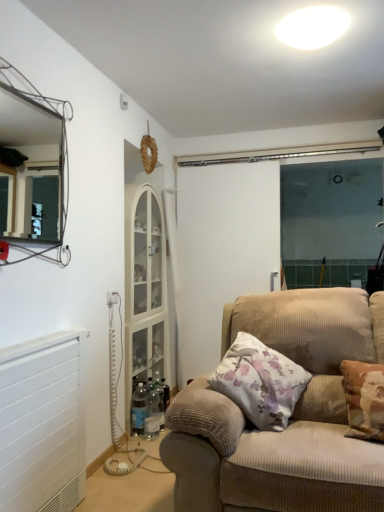
Question: Should I look upward or downward to see white floral cushion at right?

Choices:
 (A) up
 (B) down

Answer: (B)

Question: Is white plastic electric outlet at lower left further to the viewer compared to white floral cushion at right?

Choices:
 (A) yes
 (B) no

Answer: (A)

Question: Can you confirm if white plastic electric outlet at lower left is positioned to the left of white floral cushion at right?

Choices:
 (A) no
 (B) yes

Answer: (B)

Question: From the image's perspective, is white plastic electric outlet at lower left on white floral cushion at right?

Choices:
 (A) yes
 (B) no

Answer: (A)

Question: From a real-world perspective, is white plastic electric outlet at lower left on top of white floral cushion at right?

Choices:
 (A) yes
 (B) no

Answer: (A)

Question: Does white plastic electric outlet at lower left have a greater height compared to white floral cushion at right?

Choices:
 (A) yes
 (B) no

Answer: (B)

Question: Does white plastic electric outlet at lower left have a larger size compared to white floral cushion at right?

Choices:
 (A) yes
 (B) no

Answer: (B)

Question: Could you tell me if white glossy ceiling light at upper center is facing beige corduroy couch at center?

Choices:
 (A) yes
 (B) no

Answer: (B)

Question: Is white glossy ceiling light at upper center further to the viewer compared to beige corduroy couch at center?

Choices:
 (A) no
 (B) yes

Answer: (B)

Question: Is white glossy ceiling light at upper center thinner than beige corduroy couch at center?

Choices:
 (A) no
 (B) yes

Answer: (B)

Question: From a real-world perspective, is white glossy ceiling light at upper center located beneath beige corduroy couch at center?

Choices:
 (A) yes
 (B) no

Answer: (B)

Question: Does white glossy ceiling light at upper center have a larger size compared to beige corduroy couch at center?

Choices:
 (A) yes
 (B) no

Answer: (B)

Question: Are white glossy ceiling light at upper center and beige corduroy couch at center far apart?

Choices:
 (A) no
 (B) yes

Answer: (B)

Question: From the image's perspective, does white plastic electric outlet at lower left appear lower than white glossy ceiling light at upper center?

Choices:
 (A) yes
 (B) no

Answer: (A)